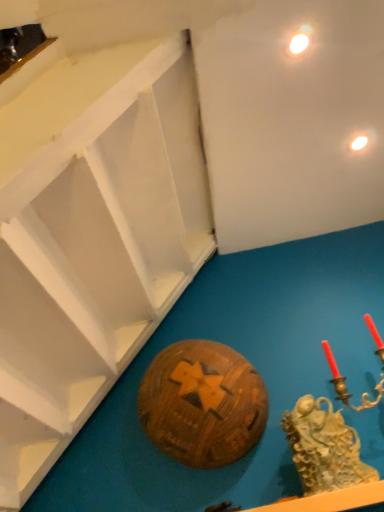
Question: From the image's perspective, is wooden ball at center located above or below gold textured sculpture at lower right?

Choices:
 (A) above
 (B) below

Answer: (A)

Question: Considering their positions, is wooden ball at center located in front of or behind gold textured sculpture at lower right?

Choices:
 (A) front
 (B) behind

Answer: (B)

Question: Which is nearer to the gold textured sculpture at lower right?

Choices:
 (A) matte white light at upper right, the second light when ordered from top to bottom
 (B) wooden ball at center
 (C) matte white light at upper right, marked as the second light in a bottom-to-top arrangement

Answer: (B)

Question: Estimate the real-world distances between objects in this image. Which object is closer to the matte white light at upper right, which is counted as the first light, starting from the left?

Choices:
 (A) gold textured sculpture at lower right
 (B) matte white light at upper right, which is the second light from left to right
 (C) wooden ball at center

Answer: (B)